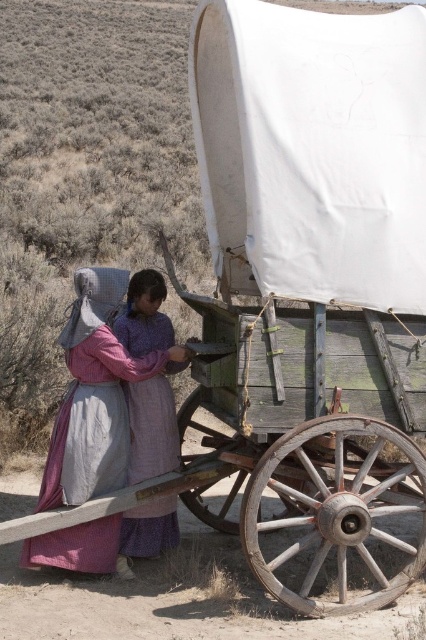
Question: Which of these objects is positioned farthest from the white canvas wagon at upper center?

Choices:
 (A) wooden wagon at center
 (B) matte purple dress at center
 (C) rustic woolen dress at lower left

Answer: (B)

Question: Which point is farther to the camera?

Choices:
 (A) (161, 515)
 (B) (327, 470)
 (C) (299, 260)
 (D) (80, 330)

Answer: (A)

Question: Estimate the real-world distances between objects in this image. Which object is closer to the white canvas wagon at upper center?

Choices:
 (A) wooden wagon at center
 (B) matte purple dress at center
 (C) rustic woolen dress at lower left

Answer: (A)

Question: Is white canvas wagon at upper center below matte purple dress at center?

Choices:
 (A) yes
 (B) no

Answer: (B)

Question: In this image, where is white canvas wagon at upper center located relative to matte purple dress at center?

Choices:
 (A) left
 (B) right

Answer: (B)

Question: In this image, where is rustic woolen dress at lower left located relative to matte purple dress at center?

Choices:
 (A) below
 (B) above

Answer: (B)